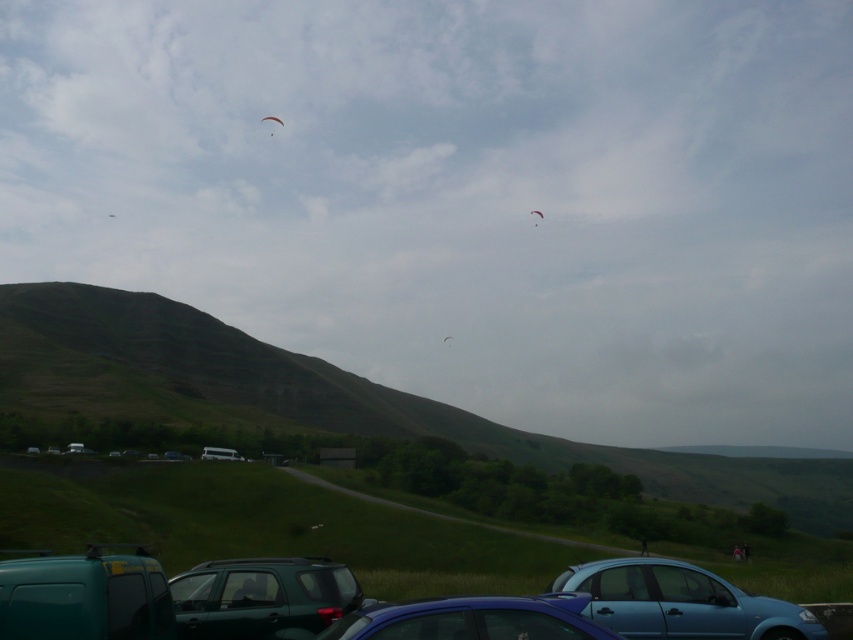
You are a delivery driver who needs to park your vehicle in the parking lot. You have a teal matte van at lower left and a metallic blue car at center. Which vehicle requires more vertical clearance to avoid scraping the roof when entering a low bridge ahead?

The teal matte van at lower left requires more vertical clearance because it is taller than the metallic blue car at center, so it needs higher clearance to avoid scraping the roof.

You are standing at the parking area and want to walk towards the hill. There are two points marked on the path you need to take. The first point is at point (x=744, y=545) and the second is at point (x=734, y=557). Which point should you reach first?

You should reach point (x=734, y=557) first because it is in front of point (x=744, y=545) according to the spatial arrangement.

You are standing in the parking area and see the light blue jeans at lower right and the white fabric kite at center. Which object is taller?

The light blue jeans at lower right is much taller than the white fabric kite at center.